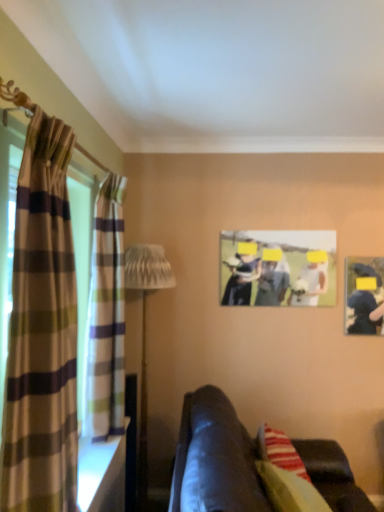
Question: Is white textured lamp at left closer to the viewer compared to plaid fabric curtain at left, positioned as the first curtain in back-to-front order?

Choices:
 (A) yes
 (B) no

Answer: (B)

Question: Can you confirm if white textured lamp at left is positioned to the right of plaid fabric curtain at left, which is counted as the 2th curtain, starting from the front?

Choices:
 (A) no
 (B) yes

Answer: (B)

Question: Is white textured lamp at left turned away from plaid fabric curtain at left, which is counted as the 2th curtain, starting from the front?

Choices:
 (A) no
 (B) yes

Answer: (A)

Question: Does white textured lamp at left have a greater height compared to plaid fabric curtain at left, which is counted as the 2th curtain, starting from the front?

Choices:
 (A) yes
 (B) no

Answer: (A)

Question: From a real-world perspective, is white textured lamp at left located beneath plaid fabric curtain at left, which is counted as the 2th curtain, starting from the front?

Choices:
 (A) yes
 (B) no

Answer: (A)

Question: From a real-world perspective, relative to plaid fabric curtain at left, positioned as the first curtain in back-to-front order, is plaid fabric curtain at left, the second curtain viewed from the back, vertically above or below?

Choices:
 (A) above
 (B) below

Answer: (B)

Question: Which is correct: plaid fabric curtain at left, which appears as the 1th curtain when viewed from the front, is inside plaid fabric curtain at left, which is counted as the 2th curtain, starting from the front, or outside of it?

Choices:
 (A) outside
 (B) inside

Answer: (A)

Question: From the image's perspective, is plaid fabric curtain at left, which appears as the 1th curtain when viewed from the front, positioned above or below plaid fabric curtain at left, positioned as the first curtain in back-to-front order?

Choices:
 (A) below
 (B) above

Answer: (A)

Question: Considering their positions, is plaid fabric curtain at left, which appears as the 1th curtain when viewed from the front, located in front of or behind plaid fabric curtain at left, which is counted as the 2th curtain, starting from the front?

Choices:
 (A) behind
 (B) front

Answer: (B)

Question: Is matte plastic picture frame at center in front of or behind plaid fabric curtain at left, which appears as the 1th curtain when viewed from the front, in the image?

Choices:
 (A) front
 (B) behind

Answer: (B)

Question: In terms of size, does matte plastic picture frame at center appear bigger or smaller than plaid fabric curtain at left, which appears as the 1th curtain when viewed from the front?

Choices:
 (A) big
 (B) small

Answer: (B)

Question: Considering the positions of point (314, 243) and point (29, 350), is point (314, 243) closer or farther from the camera than point (29, 350)?

Choices:
 (A) closer
 (B) farther

Answer: (B)

Question: Choose the correct answer: Is matte plastic picture frame at center inside plaid fabric curtain at left, which appears as the 1th curtain when viewed from the front, or outside it?

Choices:
 (A) inside
 (B) outside

Answer: (B)

Question: Is plaid fabric curtain at left, positioned as the first curtain in back-to-front order, bigger or smaller than plaid fabric curtain at left, the second curtain viewed from the back?

Choices:
 (A) small
 (B) big

Answer: (B)

Question: Considering the positions of point (115, 206) and point (34, 330), is point (115, 206) closer or farther from the camera than point (34, 330)?

Choices:
 (A) farther
 (B) closer

Answer: (A)